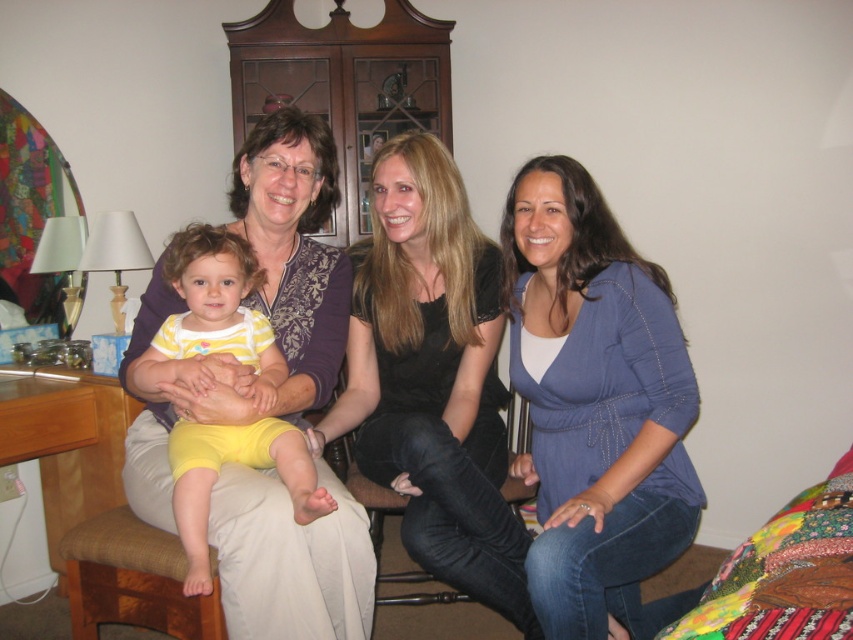
From the picture: You are standing in the living room and want to hand a gift to the person wearing the matte black shirt at center. Based on their position relative to the other people in the scene, where should you approach from?

The matte black shirt at center is located at point (404, 352), which places it centrally in the scene. Approach from the front to ensure you are facing the person directly.

In the scene described, there is a woman holding a child and another woman seated to the right. Where is the matte blue blouse at center located in relation to the two women?

The matte blue blouse at center is located at the coordinates point (x=596, y=406) in the scene.

You are a fashion designer analyzing clothing dimensions in the image. You have two black shirts in front of you, one labeled as matte black shirt at center and the other as black matte shirt at center. Which one is wider?

The matte black shirt at center is wider than the black matte shirt at center according to the description.